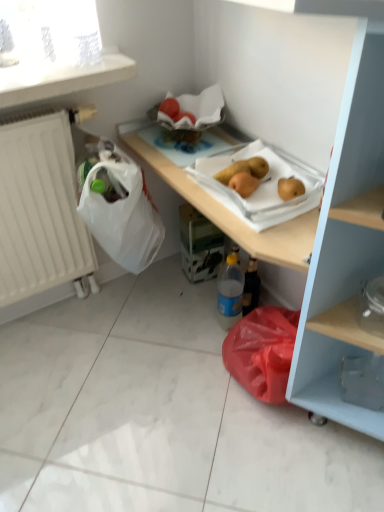
The height and width of the screenshot is (512, 384). Identify the location of vacant space in front of white matte radiator at left. (63, 356).